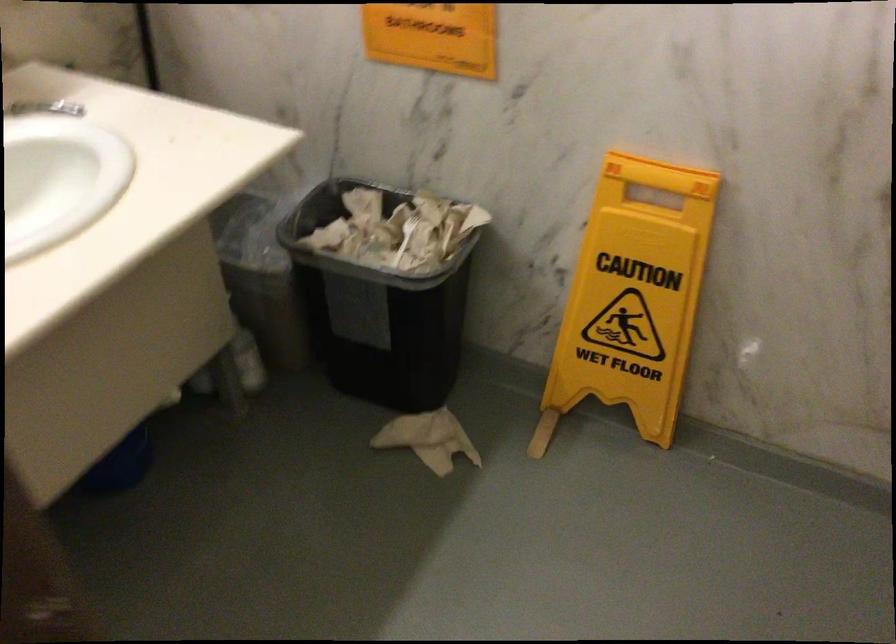
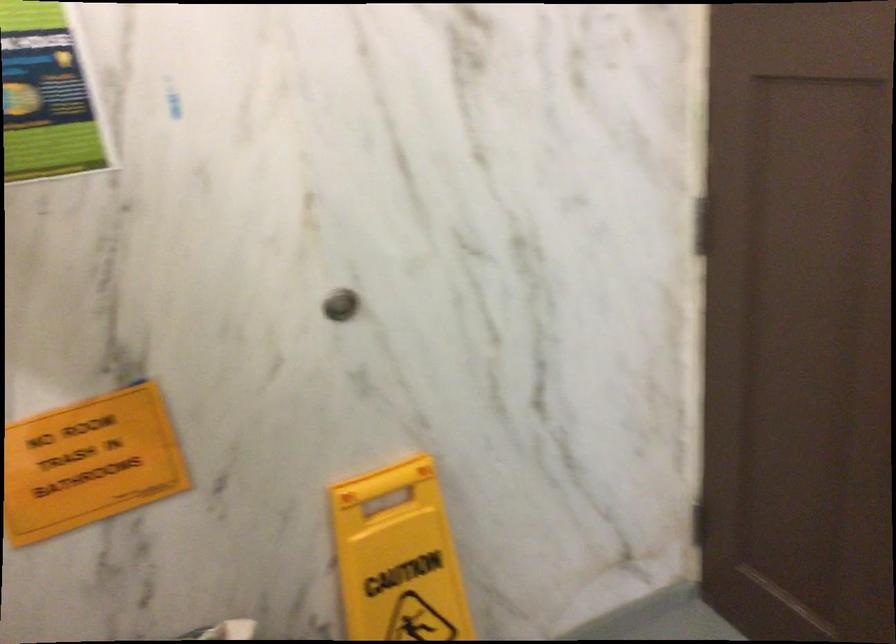
Question: The camera is either moving clockwise (left) or counter-clockwise (right) around the object. The first image is from the beginning of the video and the second image is from the end. Is the camera moving left or right when shooting the video?

Choices:
 (A) Left
 (B) Right

Answer: (A)